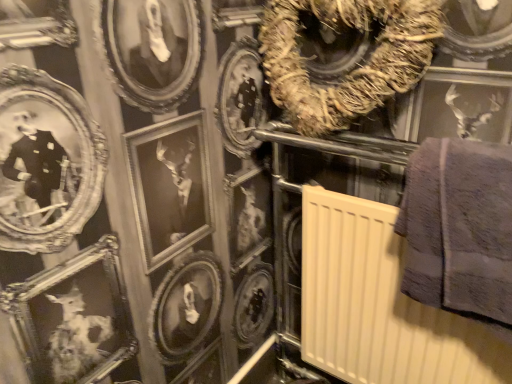
Question: From the image's perspective, would you say brown textured wreath at upper center is positioned over gray fluffy towel at right?

Choices:
 (A) no
 (B) yes

Answer: (B)

Question: Is brown textured wreath at upper center at the left side of gray fluffy towel at right?

Choices:
 (A) no
 (B) yes

Answer: (B)

Question: From a real-world perspective, is brown textured wreath at upper center on gray fluffy towel at right?

Choices:
 (A) yes
 (B) no

Answer: (A)

Question: Is brown textured wreath at upper center closer to camera compared to gray fluffy towel at right?

Choices:
 (A) yes
 (B) no

Answer: (B)

Question: Considering the relative sizes of brown textured wreath at upper center and gray fluffy towel at right in the image provided, is brown textured wreath at upper center bigger than gray fluffy towel at right?

Choices:
 (A) no
 (B) yes

Answer: (B)

Question: Can we say brown textured wreath at upper center lies outside gray fluffy towel at right?

Choices:
 (A) yes
 (B) no

Answer: (A)

Question: Is beige plastic radiator at center-right positioned beyond the bounds of brown textured wreath at upper center?

Choices:
 (A) no
 (B) yes

Answer: (B)

Question: Is beige plastic radiator at center-right thinner than brown textured wreath at upper center?

Choices:
 (A) yes
 (B) no

Answer: (B)

Question: Is the depth of beige plastic radiator at center-right less than that of brown textured wreath at upper center?

Choices:
 (A) no
 (B) yes

Answer: (B)

Question: Does beige plastic radiator at center-right have a lesser height compared to brown textured wreath at upper center?

Choices:
 (A) yes
 (B) no

Answer: (B)

Question: Could you tell me if beige plastic radiator at center-right is facing brown textured wreath at upper center?

Choices:
 (A) no
 (B) yes

Answer: (A)

Question: Considering the relative sizes of beige plastic radiator at center-right and brown textured wreath at upper center in the image provided, is beige plastic radiator at center-right taller than brown textured wreath at upper center?

Choices:
 (A) no
 (B) yes

Answer: (B)

Question: Does brown textured wreath at upper center have a greater width compared to beige plastic radiator at center-right?

Choices:
 (A) no
 (B) yes

Answer: (A)